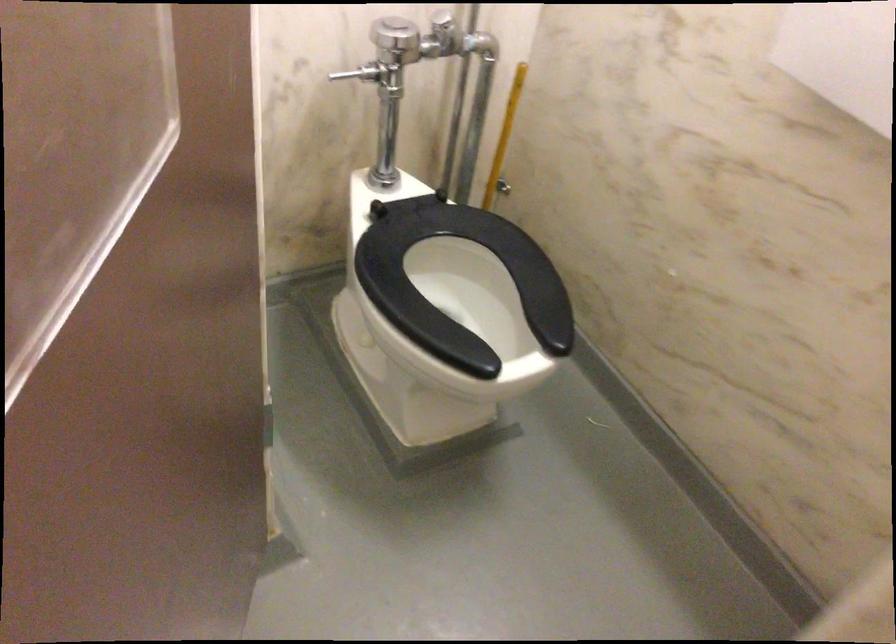
Where would you lift the yellow plunger handle? Please return your answer as a coordinate pair (x, y).

(504, 137)